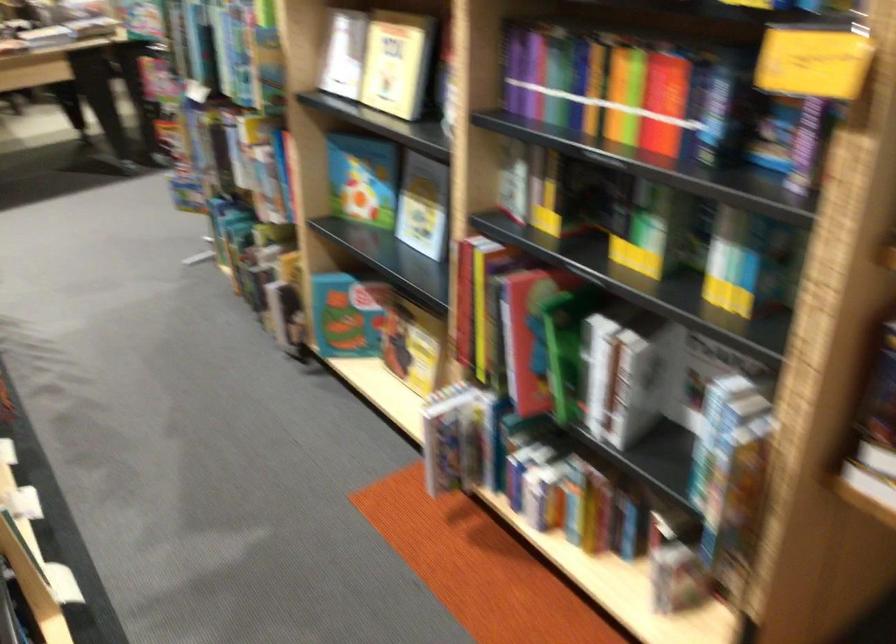
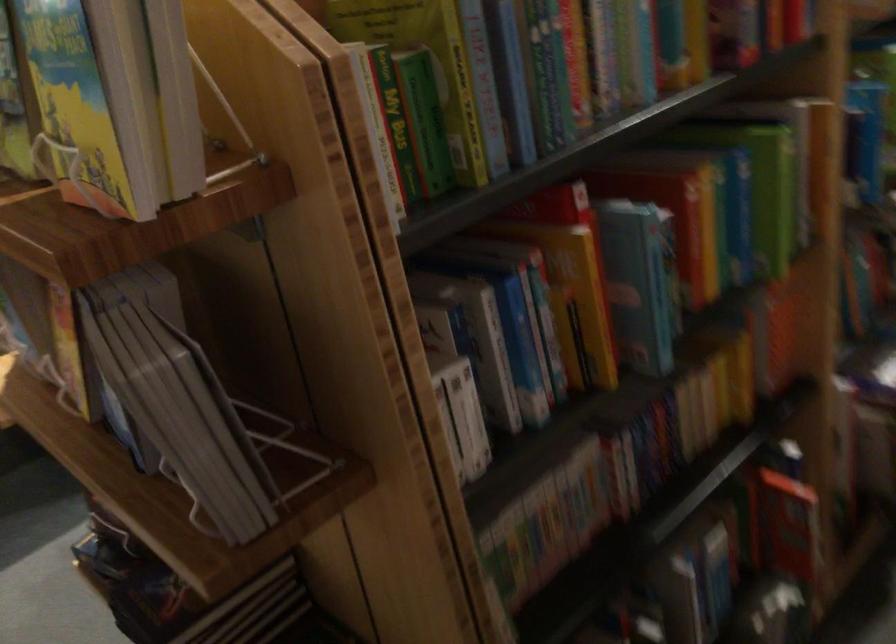
Question: I am providing you with two images of the same scene from different viewpoints. Which of the following objects are not visible in image2?

Choices:
 (A) white cup handle
 (B) blue picture book
 (C) yellow cover book
 (D) green round lid

Answer: (B)